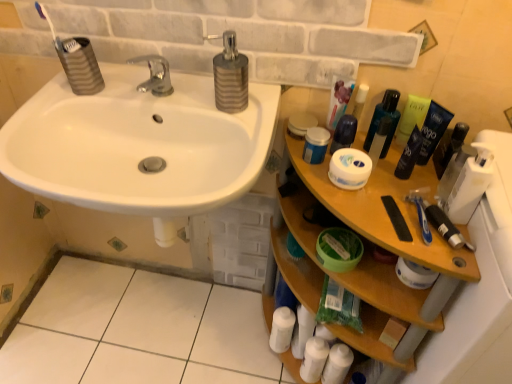
This screenshot has height=384, width=512. In order to click on vacant space situated on the left part of white matte bottle at lower center, which ranks as the 1th toiletry in left-to-right order in this screenshot , I will do `click(231, 344)`.